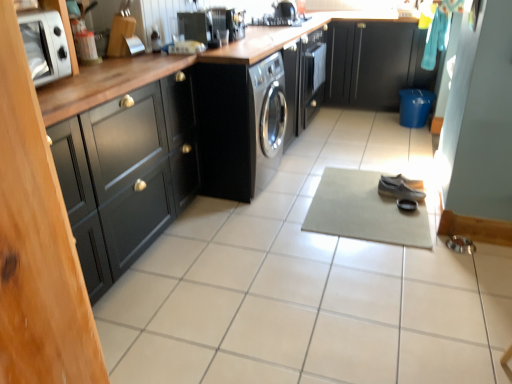
Question: Is beige fabric yoga mat at center facing away from black matte cabinet at left, which is counted as the first cabinetry, starting from the left?

Choices:
 (A) yes
 (B) no

Answer: (B)

Question: Is beige fabric yoga mat at center not within black matte cabinet at left, which is counted as the first cabinetry, starting from the left?

Choices:
 (A) no
 (B) yes

Answer: (B)

Question: Can you confirm if beige fabric yoga mat at center is smaller than black matte cabinet at left, the first cabinetry ordered from the bottom?

Choices:
 (A) yes
 (B) no

Answer: (A)

Question: Is beige fabric yoga mat at center behind black matte cabinet at left, the 2th cabinetry in the top-to-bottom sequence?

Choices:
 (A) no
 (B) yes

Answer: (B)

Question: From a real-world perspective, is beige fabric yoga mat at center positioned under black matte cabinet at left, positioned as the 1th cabinetry in front-to-back order, based on gravity?

Choices:
 (A) no
 (B) yes

Answer: (B)

Question: Is beige fabric yoga mat at center oriented towards black matte cabinet at left, the first cabinetry ordered from the bottom?

Choices:
 (A) yes
 (B) no

Answer: (B)

Question: Can you confirm if beige fabric yoga mat at center is wider than black glossy stove at upper center?

Choices:
 (A) yes
 (B) no

Answer: (A)

Question: From a real-world perspective, is beige fabric yoga mat at center physically below black glossy stove at upper center?

Choices:
 (A) no
 (B) yes

Answer: (B)

Question: Is black glossy stove at upper center inside beige fabric yoga mat at center?

Choices:
 (A) no
 (B) yes

Answer: (A)

Question: Would you say beige fabric yoga mat at center is outside black glossy stove at upper center?

Choices:
 (A) yes
 (B) no

Answer: (A)

Question: Is beige fabric yoga mat at center taller than black glossy stove at upper center?

Choices:
 (A) no
 (B) yes

Answer: (A)

Question: Is beige fabric yoga mat at center far away from black glossy stove at upper center?

Choices:
 (A) yes
 (B) no

Answer: (A)

Question: Is leather shoe at center, which ranks as the second shoe in back-to-front order, placed right next to black matte cabinet at left, which is counted as the 2th cabinetry, starting from the back?

Choices:
 (A) no
 (B) yes

Answer: (A)